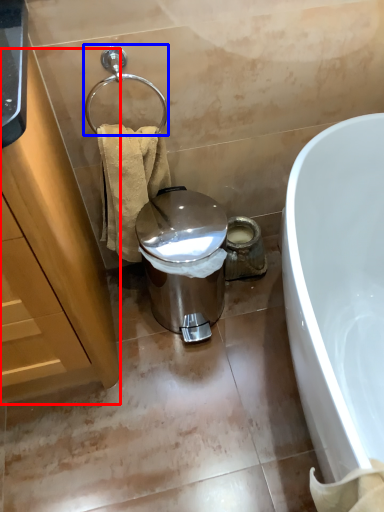
Question: Among these objects, which one is nearest to the camera, cabinetry (highlighted by a red box) or shower (highlighted by a blue box)?

Choices:
 (A) cabinetry
 (B) shower

Answer: (A)